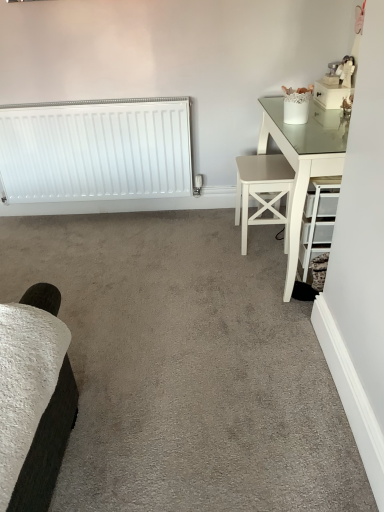
Question: From the image's perspective, is white wood stool at right positioned above or below white matte radiator at left?

Choices:
 (A) below
 (B) above

Answer: (A)

Question: Is white wood stool at right wider or thinner than white matte radiator at left?

Choices:
 (A) thin
 (B) wide

Answer: (B)

Question: Is point (274, 202) closer or farther from the camera than point (67, 142)?

Choices:
 (A) closer
 (B) farther

Answer: (A)

Question: Choose the correct answer: Is white matte radiator at left inside white wood stool at right or outside it?

Choices:
 (A) inside
 (B) outside

Answer: (B)

Question: Considering the relative positions of white matte radiator at left and white wood stool at right in the image provided, is white matte radiator at left to the left or to the right of white wood stool at right?

Choices:
 (A) left
 (B) right

Answer: (A)

Question: In terms of size, does white matte radiator at left appear bigger or smaller than white wood stool at right?

Choices:
 (A) small
 (B) big

Answer: (B)

Question: From a real-world perspective, is white matte radiator at left above or below white wood stool at right?

Choices:
 (A) below
 (B) above

Answer: (B)